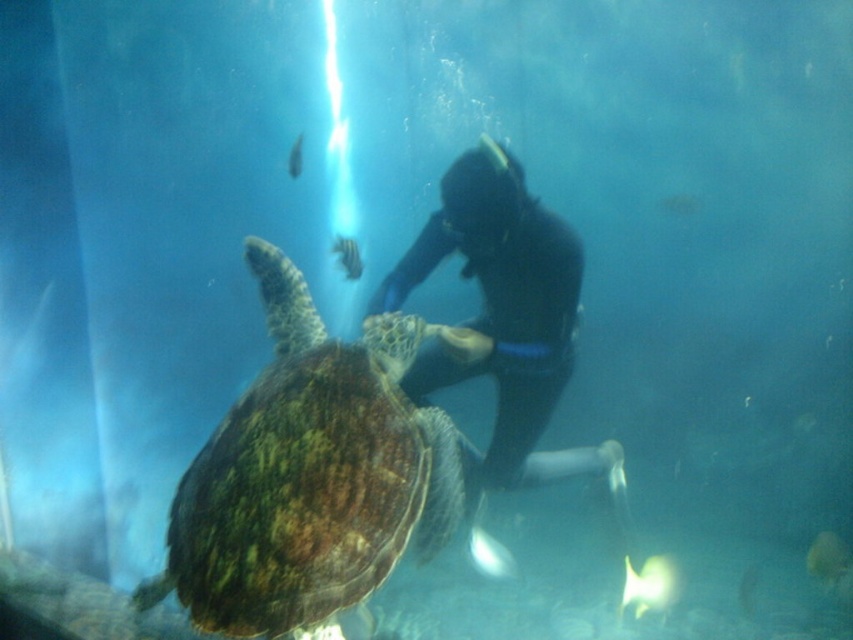
You are a marine biologist observing the underwater scene. You notice the black rubber suit at center and the shiny blue fish at center. Which object is positioned to the right side of the other?

The black rubber suit at center is to the right of the shiny blue fish at center.